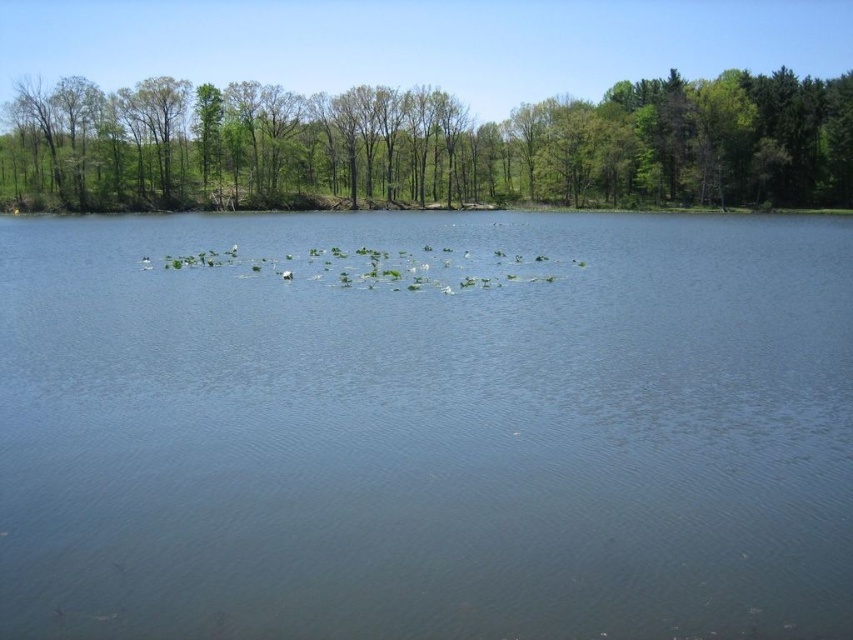
Image resolution: width=853 pixels, height=640 pixels. Describe the element at coordinates (427, 433) in the screenshot. I see `clear blue water at center` at that location.

What do you see at coordinates (427, 433) in the screenshot? The image size is (853, 640). I see `clear blue water at center` at bounding box center [427, 433].

The height and width of the screenshot is (640, 853). Find the location of `clear blue water at center`. clear blue water at center is located at coordinates (427, 433).